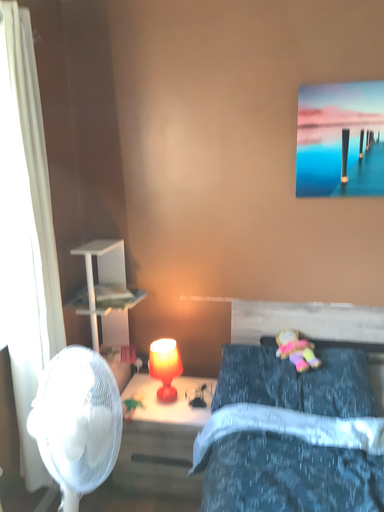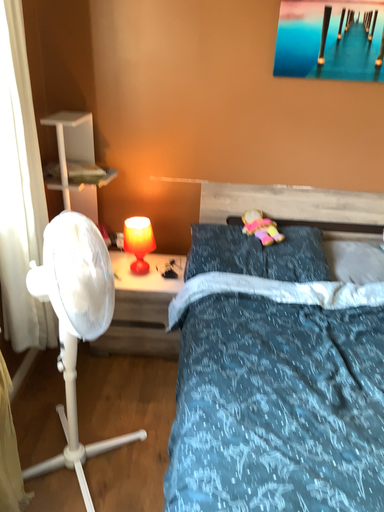
Question: How did the camera likely rotate when shooting the video?

Choices:
 (A) rotated right
 (B) rotated left

Answer: (A)